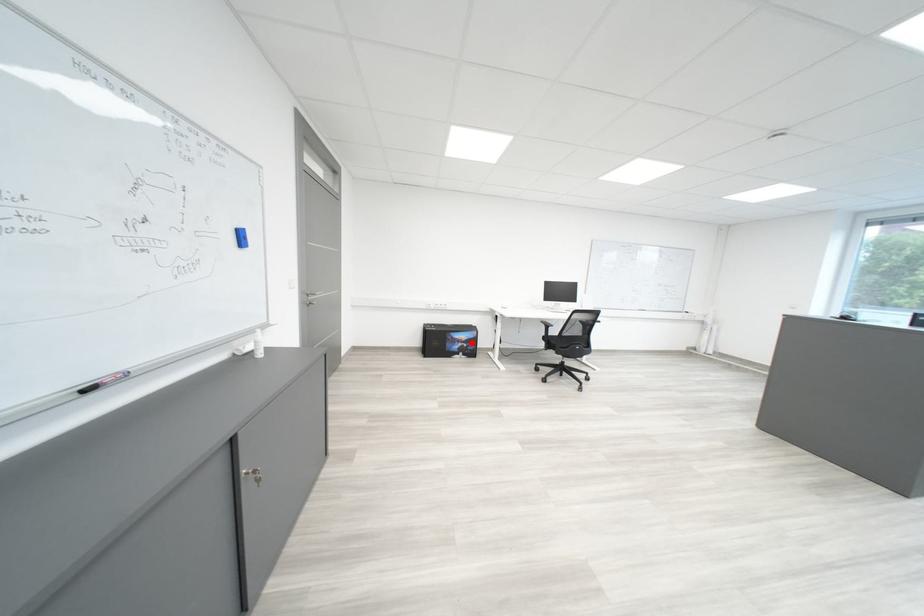
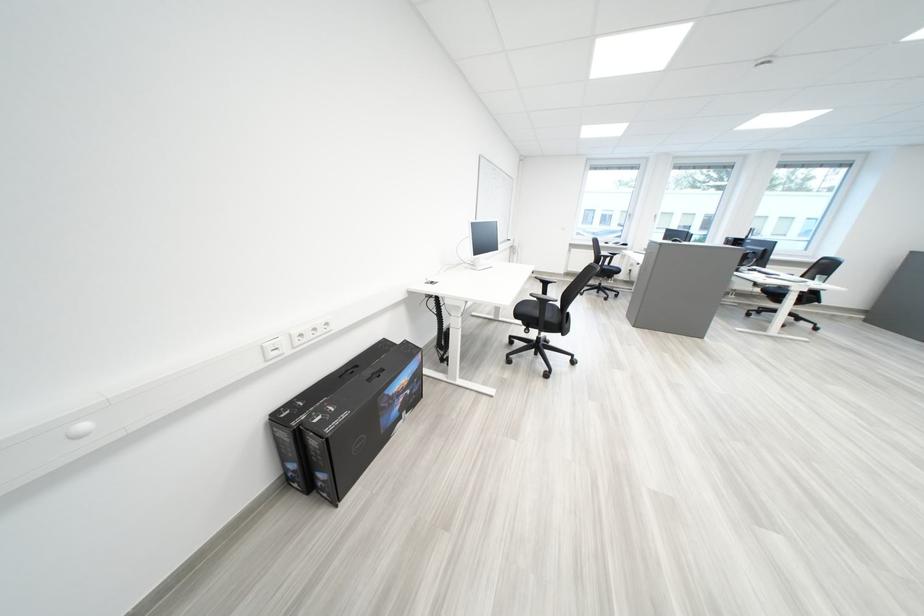
In the second image, find the point that corresponds to the highlighted location in the first image.

(411, 395)